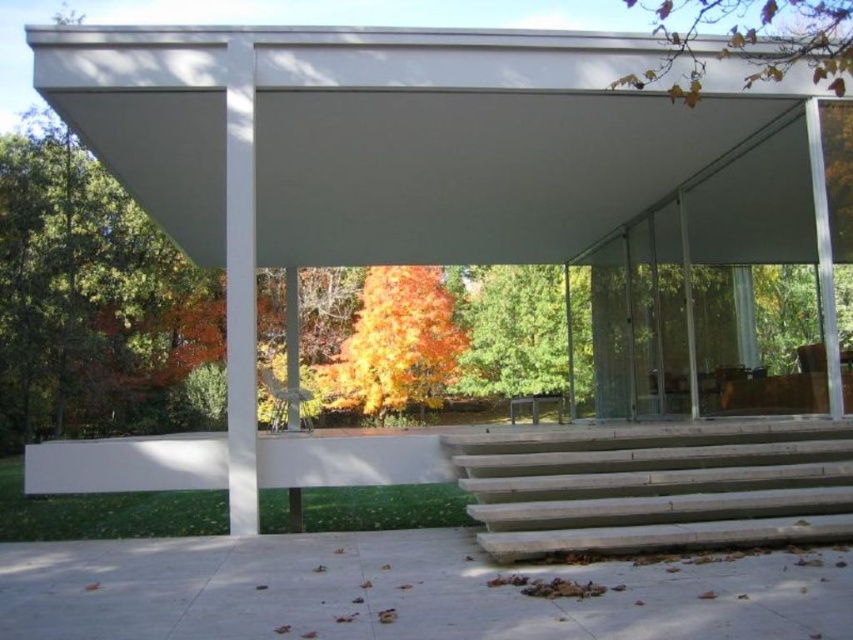
You are a visitor approaching the entrance of the modern pavilion. You notice the white matte canopy at upper center and the concrete stairs at lower right. Which of these two objects is larger in size?

The white matte canopy at upper center is bigger than the concrete stairs at lower right, so the white matte canopy at upper center is the larger object.

You are standing at the entrance of the modern architectural structure and notice a green matte tree at center and yellow leaves at upper right. Which object is positioned lower in the scene?

The green matte tree at center is positioned lower than the yellow leaves at upper right.

You are standing at the entrance of the pavilion and notice the white matte canopy at upper center and the yellow leaves at upper right. Which object is closer to the entrance?

The white matte canopy at upper center is closer to the entrance because it is positioned under the yellow leaves at upper right, indicating it is lower in elevation.